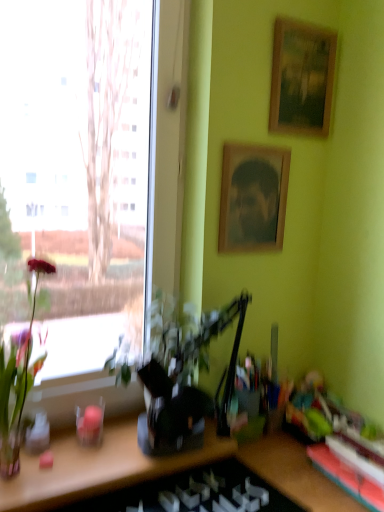
This screenshot has height=512, width=384. What are the coordinates of `free space above wooden bookshelf at lower right (from a real-world perspective)` in the screenshot? It's located at (352, 466).